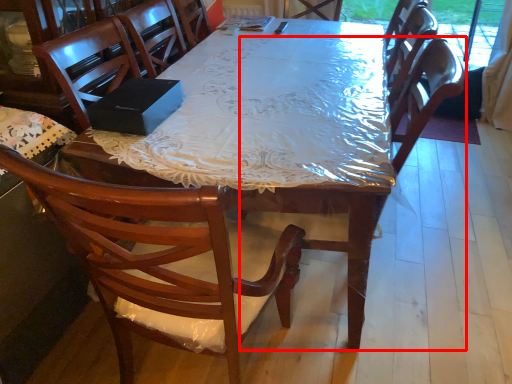
Question: From the image, what is the correct spatial relationship of armchair (annotated by the red box) in relation to desk?

Choices:
 (A) right
 (B) left

Answer: (B)